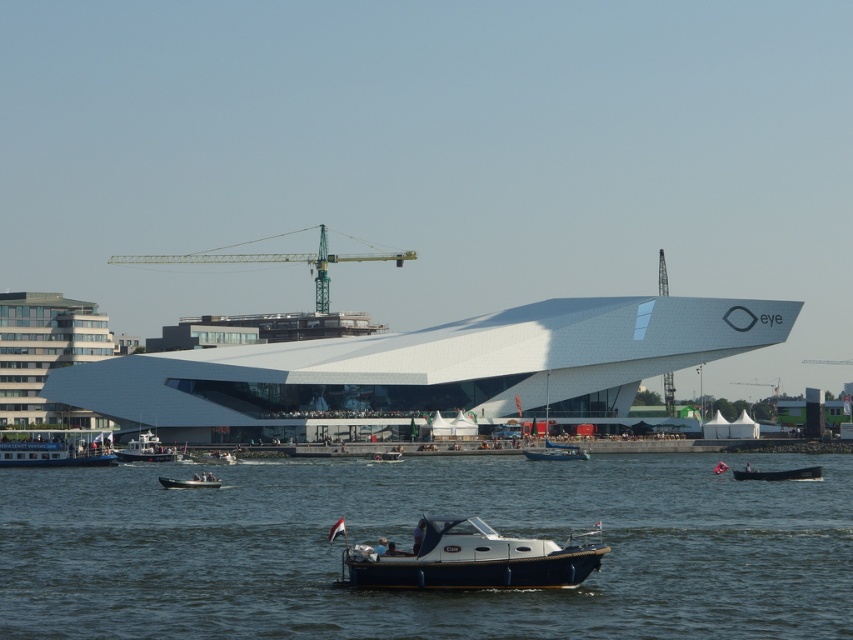
You are standing on the dock and see the transparent blue water at center and the white plastic boat at left. Which object is closer to your left side?

The white plastic boat at left is closer to your left side since it is positioned to the left of the transparent blue water at center.

You are a drone operator trying to capture a photo of the modern architectural structure. The drone is currently hovering at point 0.852, 0.481. What should you adjust to avoid the transparent blue water at center?

The transparent blue water at center is located at point (409, 545) where the drone is currently hovering. To avoid it, the drone should adjust its position to a different coordinate away from that point.

You are standing at the center of the waterfront scene. Which direction should you walk to reach the white plastic boat at left?

Since the white plastic boat at left is located at coordinates approximately 0.703 on the x and 0.171 on the y axis, you should walk towards the left side of the waterfront to reach it.